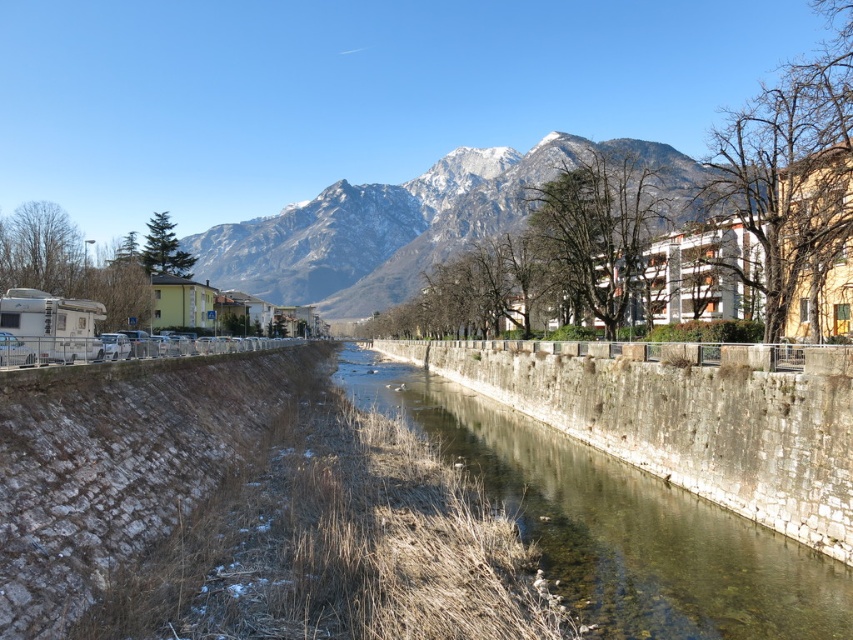
Question: Which point is farther from the camera taking this photo?

Choices:
 (A) (357, 291)
 (B) (845, 620)

Answer: (A)

Question: Does clear stone wall at center appear under snowy rock mountain at upper center?

Choices:
 (A) yes
 (B) no

Answer: (A)

Question: Is clear stone wall at center closer to the viewer compared to snowy rock mountain at upper center?

Choices:
 (A) no
 (B) yes

Answer: (B)

Question: Can you confirm if clear stone wall at center is smaller than snowy rock mountain at upper center?

Choices:
 (A) no
 (B) yes

Answer: (B)

Question: Which of the following is the closest to the observer?

Choices:
 (A) clear stone wall at center
 (B) snowy rock mountain at upper center

Answer: (A)